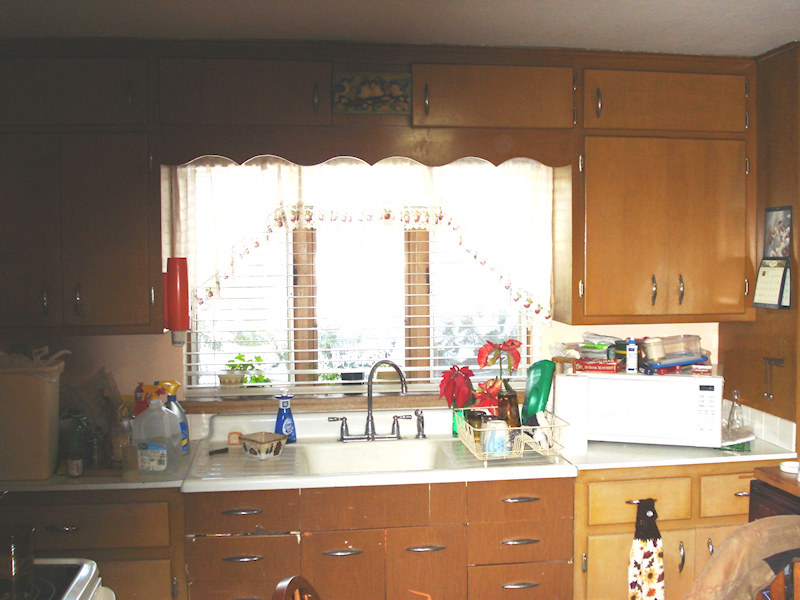
Identify the location of dish soap. (284, 413).